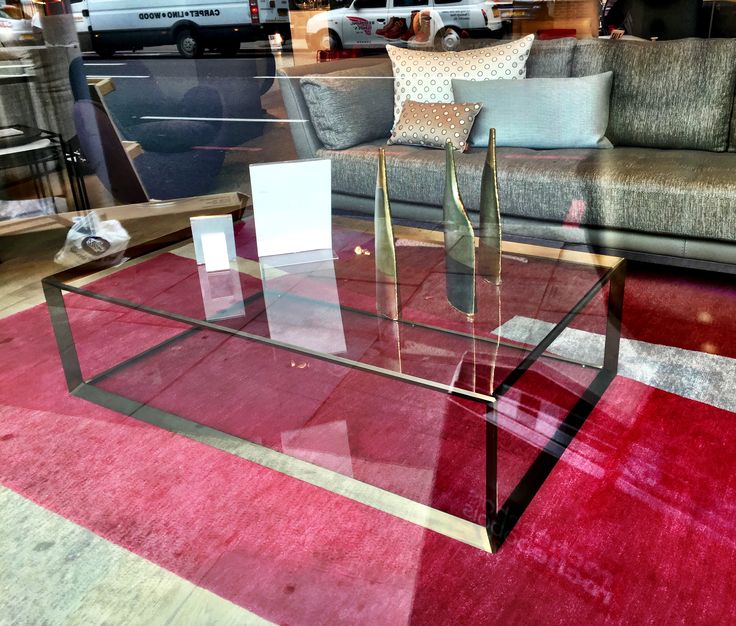
Where is `carpet`? The height and width of the screenshot is (626, 736). carpet is located at coordinates (121, 523), (91, 562).